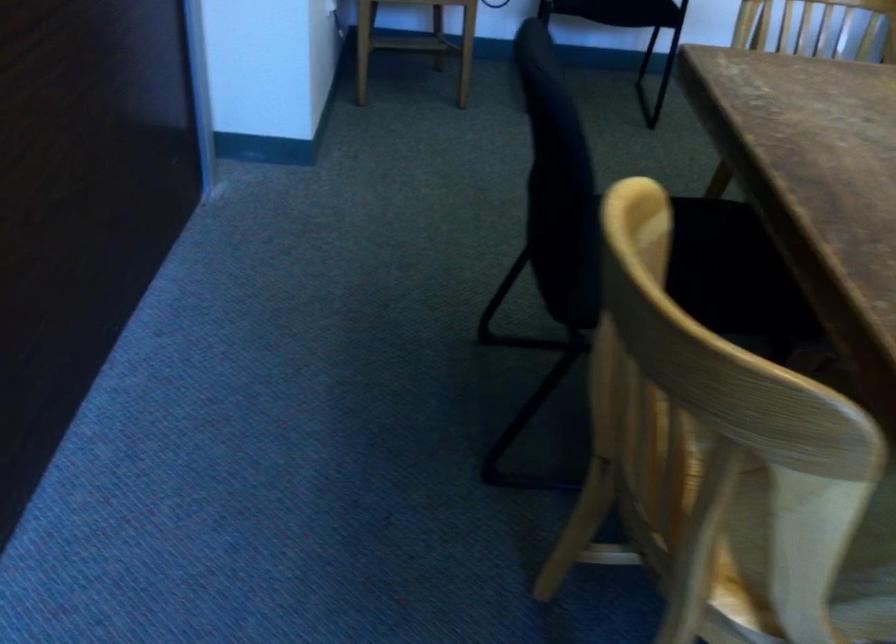
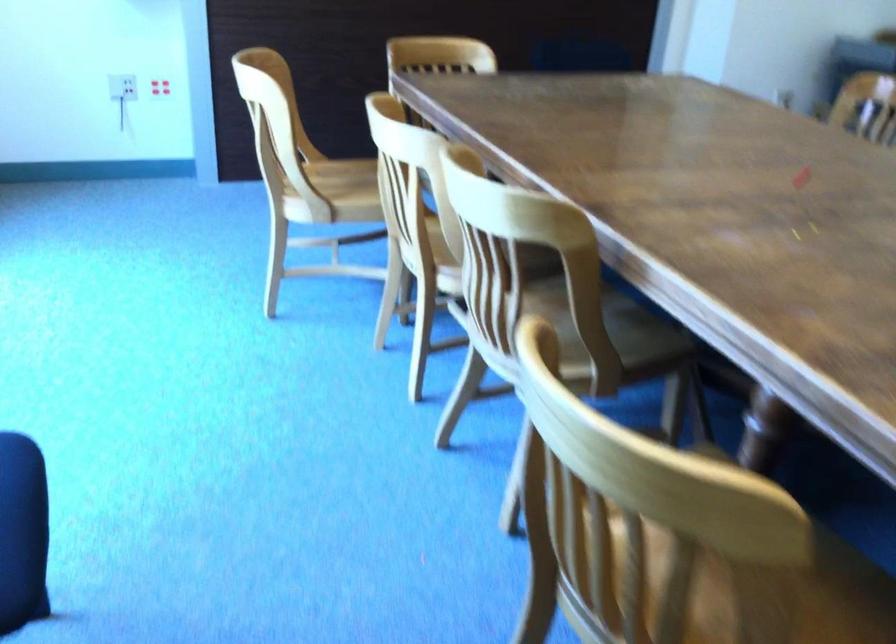
Question: I am providing you with two images of the same scene from different viewpoints. Please identify which objects are invisible in image2.

Choices:
 (A) wooden chair sitting surface
 (B) wooden chair armrest
 (C) red electrical outlet
 (D) yellow bicycle handlebar

Answer: (B)